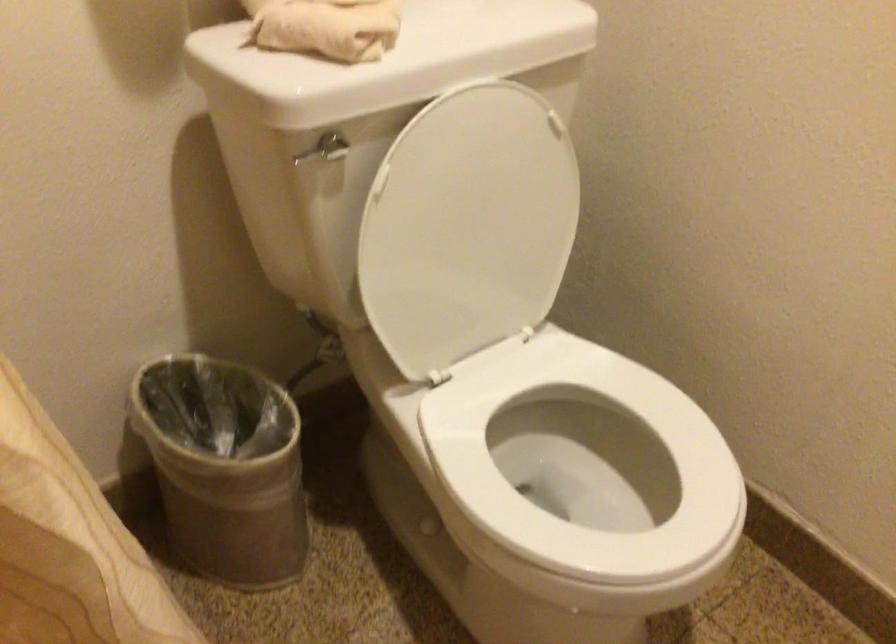
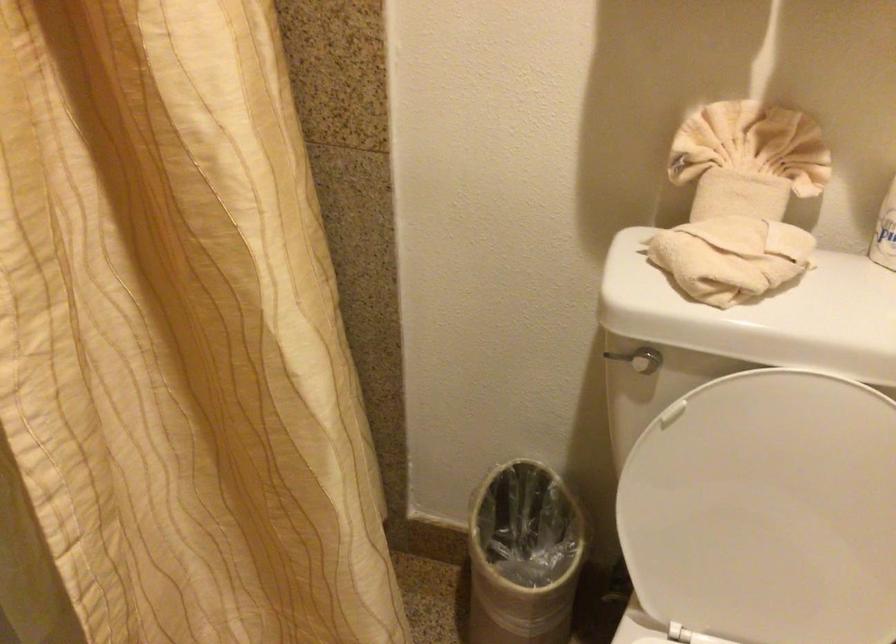
Question: The camera is either moving clockwise (left) or counter-clockwise (right) around the object. The first image is from the beginning of the video and the second image is from the end. Is the camera moving left or right when shooting the video?

Choices:
 (A) Left
 (B) Right

Answer: (B)